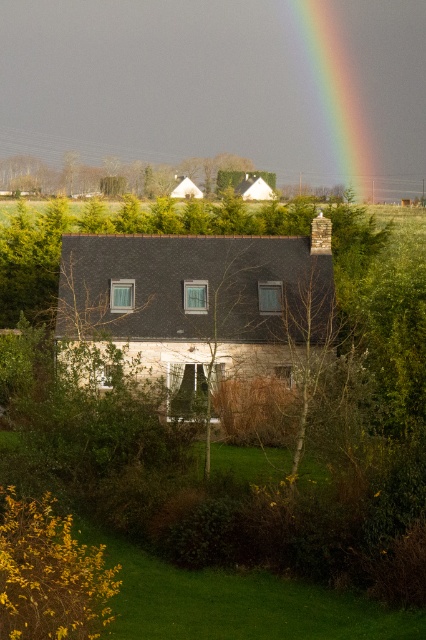
Question: Estimate the real-world distances between objects in this image. Which object is closer to the green leafy tree at upper center?

Choices:
 (A) bare branches at center
 (B) rainbow at upper center

Answer: (B)

Question: Is bare branches at center in front of green leafy tree at upper center?

Choices:
 (A) no
 (B) yes

Answer: (B)

Question: Can you confirm if bare branches at center is smaller than green leafy tree at upper center?

Choices:
 (A) no
 (B) yes

Answer: (B)

Question: Among these objects, which one is farthest from the camera?

Choices:
 (A) bare branches at center
 (B) rainbow at upper center

Answer: (B)

Question: Is bare branches at center below rainbow at upper center?

Choices:
 (A) yes
 (B) no

Answer: (A)

Question: Which of these objects is positioned closest to the bare branches at center?

Choices:
 (A) rainbow at upper center
 (B) green leafy tree at upper center

Answer: (B)